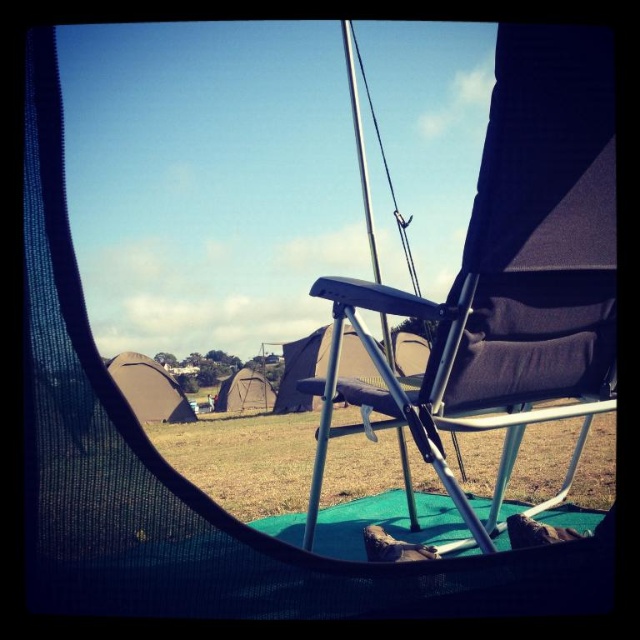
Does brown canvas tent at center have a smaller size compared to dark gray canvas tent at center?

Incorrect, brown canvas tent at center is not smaller in size than dark gray canvas tent at center.

Between point (154, 369) and point (220, 385), which one is positioned in front?

Point (154, 369) is in front.

Where is `brown canvas tent at center`? This screenshot has width=640, height=640. brown canvas tent at center is located at coordinates (148, 388).

Is point (560, 202) positioned behind point (232, 406)?

No, (560, 202) is closer to viewer.

Is dark blue fabric beach chair at center further to camera compared to dark gray canvas tent at center?

No, it is not.

Where is `dark blue fabric beach chair at center`? dark blue fabric beach chair at center is located at coordinates (508, 268).

Can you confirm if dark blue fabric beach chair at center is positioned to the right of brown canvas tent at center?

Indeed, dark blue fabric beach chair at center is positioned on the right side of brown canvas tent at center.

Who is taller, dark blue fabric beach chair at center or brown canvas tent at center?

Standing taller between the two is brown canvas tent at center.

Where is `dark blue fabric beach chair at center`? dark blue fabric beach chair at center is located at coordinates (508, 268).

The image size is (640, 640). I want to click on dark blue fabric beach chair at center, so click(x=508, y=268).